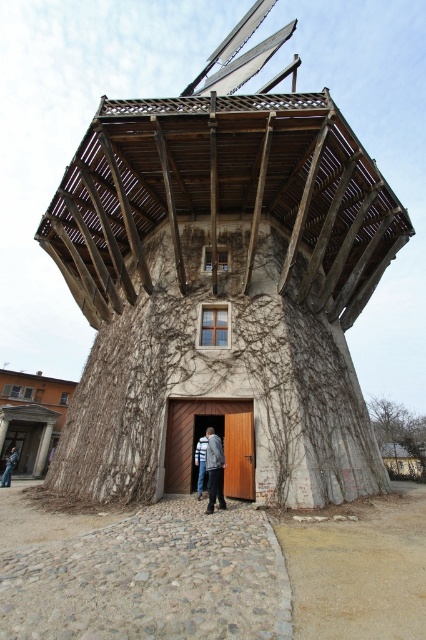
You are standing in front of the windmill and want to take a photo. There are two points marked on the windmill wall, one at point [219,204] and the other at point [11,448]. Which point will appear larger in your photo?

Point [219,204] is closer to the camera than point [11,448], so it will appear larger in the photo.

You are standing at the entrance of the wooden windmill at center and want to hang a large coat rack. The denim jacket at lower left is currently occupying some space. Considering their sizes, can the coat rack be placed without moving the denim jacket?

Answer: The wooden windmill at center is wider than the denim jacket at lower left, so there should be enough space to place the coat rack without moving the denim jacket.

You are standing in front of the windmill and want to locate the point at coordinates (221, 291). Based on the scene description, where would this point be located on the windmill?

The point at coordinates (221, 291) is located on the wooden windmill at center, likely near the entrance area where the wooden door is situated.